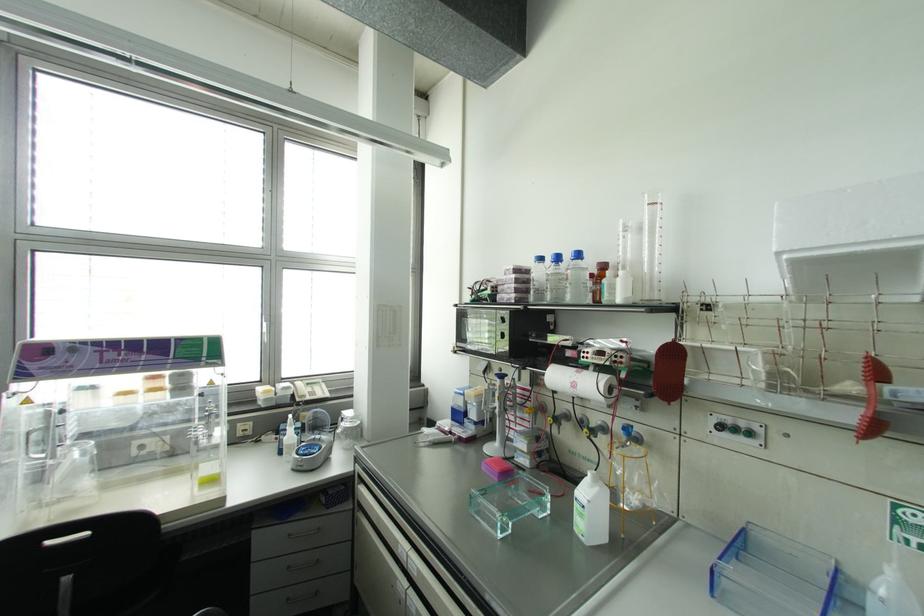
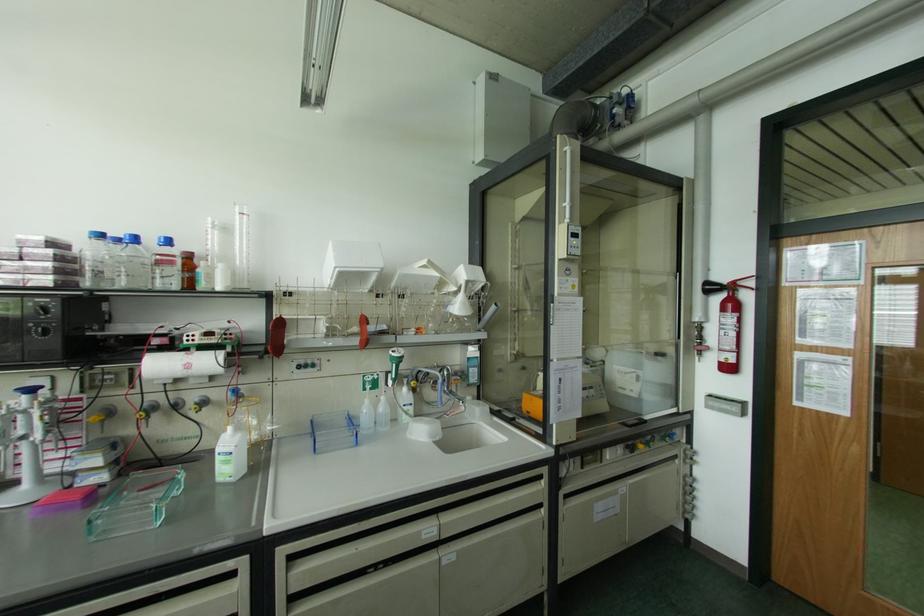
Find the pixel in the second image that matches the point at 558,424 in the first image.

(148, 416)